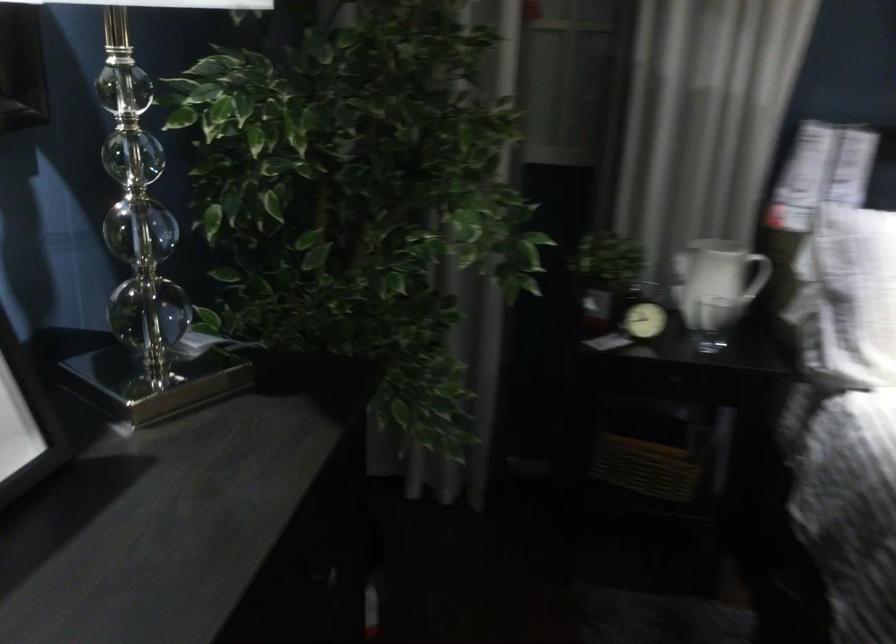
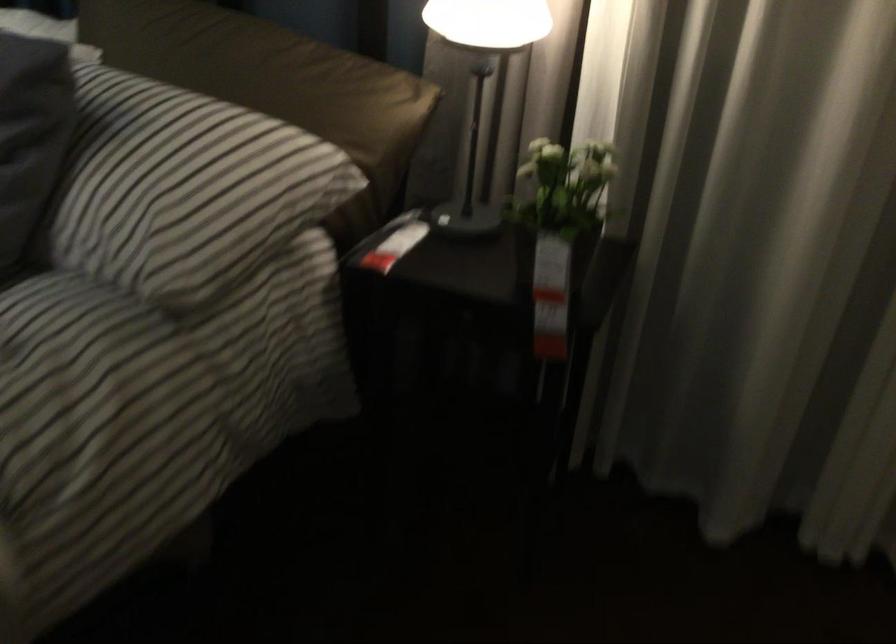
Question: In a continuous first-person perspective shot, in which direction is the camera moving?

Choices:
 (A) Left
 (B) Right
 (C) Forward
 (D) Backward

Answer: (B)